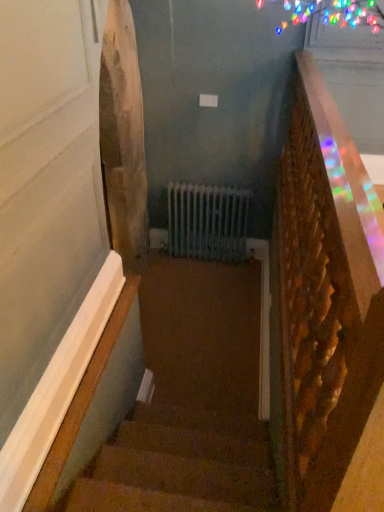
Question: Is wooden textured rail at right touching carpeted stairs at center?

Choices:
 (A) yes
 (B) no

Answer: (B)

Question: From a real-world perspective, is wooden textured rail at right below carpeted stairs at center?

Choices:
 (A) no
 (B) yes

Answer: (A)

Question: From a real-world perspective, is wooden textured rail at right located higher than carpeted stairs at center?

Choices:
 (A) yes
 (B) no

Answer: (A)

Question: Can you confirm if wooden textured rail at right is positioned to the left of carpeted stairs at center?

Choices:
 (A) no
 (B) yes

Answer: (A)

Question: Is wooden textured rail at right completely or partially outside of carpeted stairs at center?

Choices:
 (A) yes
 (B) no

Answer: (A)

Question: Does wooden textured rail at right have a larger size compared to carpeted stairs at center?

Choices:
 (A) yes
 (B) no

Answer: (A)

Question: Is carpeted stairs at center bigger than wooden textured rail at right?

Choices:
 (A) no
 (B) yes

Answer: (A)

Question: From a real-world perspective, does carpeted stairs at center stand above wooden textured rail at right?

Choices:
 (A) yes
 (B) no

Answer: (B)

Question: From the image's perspective, does carpeted stairs at center appear lower than wooden textured rail at right?

Choices:
 (A) no
 (B) yes

Answer: (B)

Question: Is carpeted stairs at center far from wooden textured rail at right?

Choices:
 (A) yes
 (B) no

Answer: (A)

Question: Does carpeted stairs at center have a lesser width compared to wooden textured rail at right?

Choices:
 (A) no
 (B) yes

Answer: (A)

Question: From a real-world perspective, is carpeted stairs at center under wooden textured rail at right?

Choices:
 (A) no
 (B) yes

Answer: (B)

Question: Looking at their shapes, would you say wooden textured rail at right is wider or thinner than carpeted stairs at center?

Choices:
 (A) wide
 (B) thin

Answer: (B)